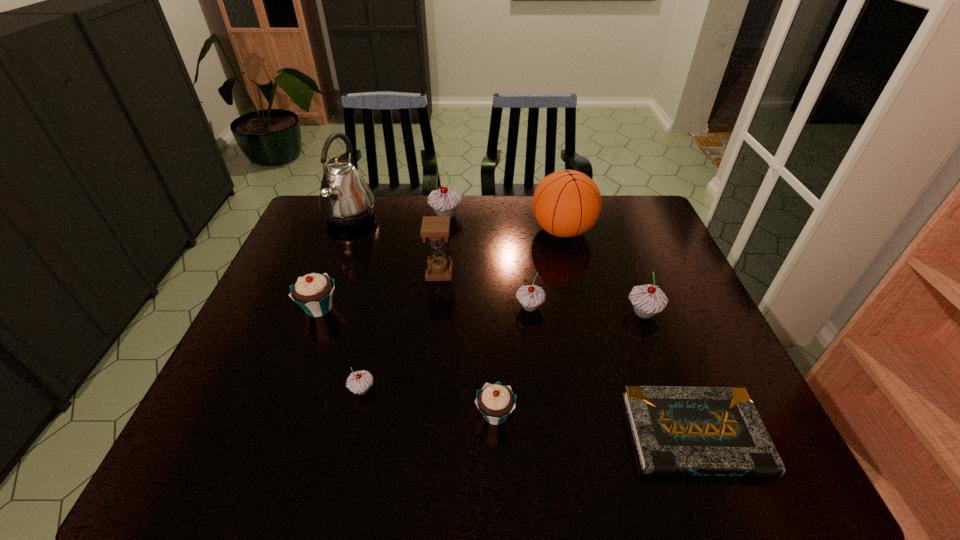
Find the location of `the leftmost cupcake`. the leftmost cupcake is located at coordinates (313, 292).

Image resolution: width=960 pixels, height=540 pixels. Find the location of `the fifth cupcake from right to left`. the fifth cupcake from right to left is located at coordinates (358, 382).

At what (x,y) coordinates should I click in order to perform the action: click on the smallest gray cupcake. Please return your answer as a coordinate pair (x, y). Image resolution: width=960 pixels, height=540 pixels. Looking at the image, I should click on (358, 382).

At what (x,y) coordinates should I click in order to perform the action: click on the right teal cupcake. Please return your answer as a coordinate pair (x, y). Looking at the image, I should click on (495, 401).

The width and height of the screenshot is (960, 540). Find the location of `the smaller teal cupcake`. the smaller teal cupcake is located at coordinates (495, 401).

The image size is (960, 540). Find the location of `notebook`. notebook is located at coordinates (717, 431).

Identify the location of free space located 0.370m on the front of the tallest object. This screenshot has width=960, height=540. (310, 318).

The image size is (960, 540). Identify the location of vacant area situated on the right of the basketball. (655, 231).

At what (x,y) coordinates should I click in order to perform the action: click on vacant space situated on the front of the tallest cupcake. Please return your answer as a coordinate pair (x, y). This screenshot has height=540, width=960. Looking at the image, I should click on (444, 239).

Locate an element on the screen. vacant space located on the front of the seventh nearest object is located at coordinates (434, 325).